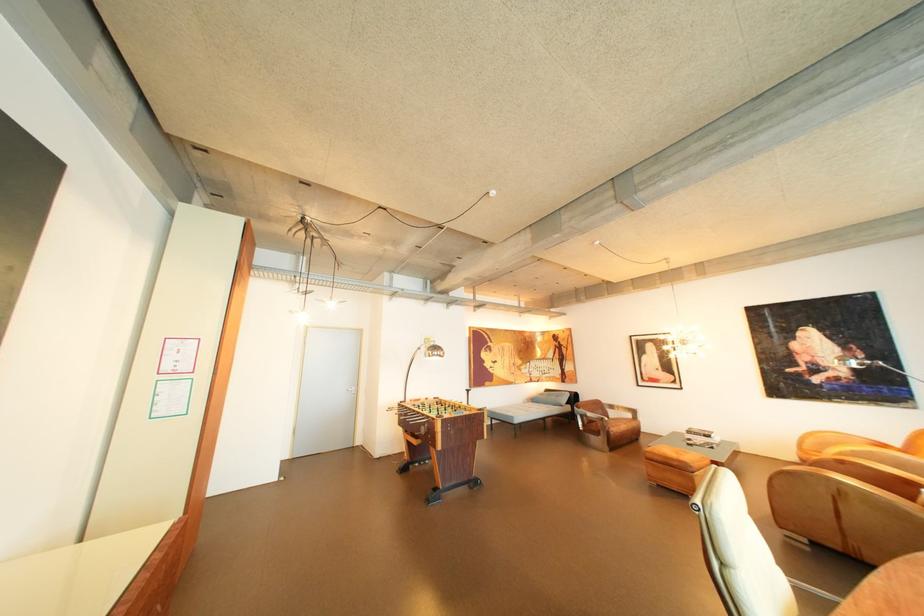
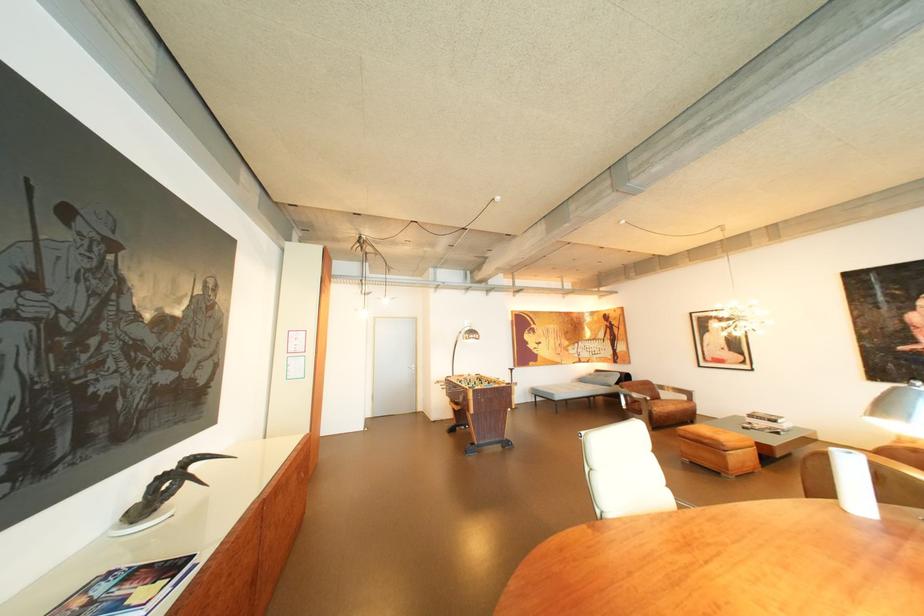
Where in the second image is the point corresponding to point 701,432 from the first image?

(763, 416)